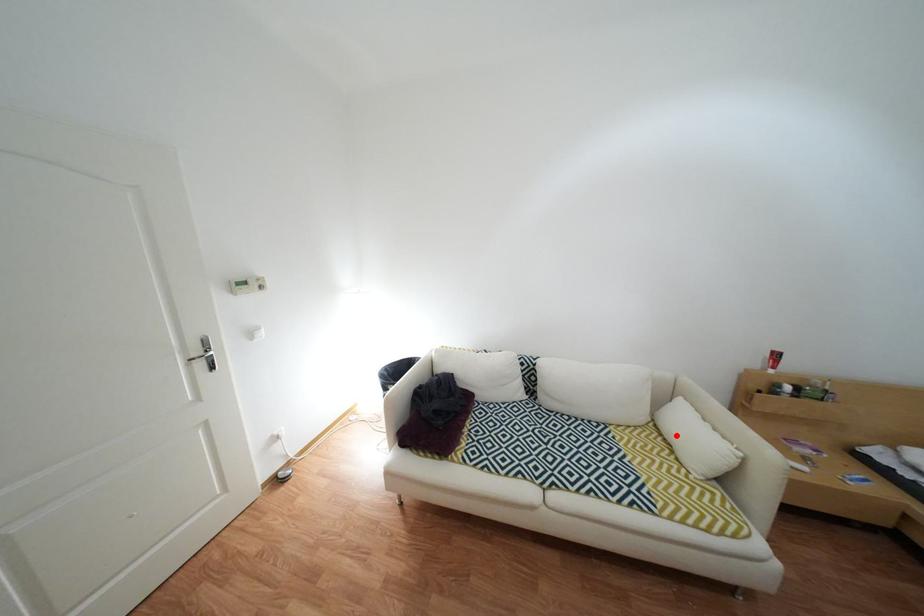
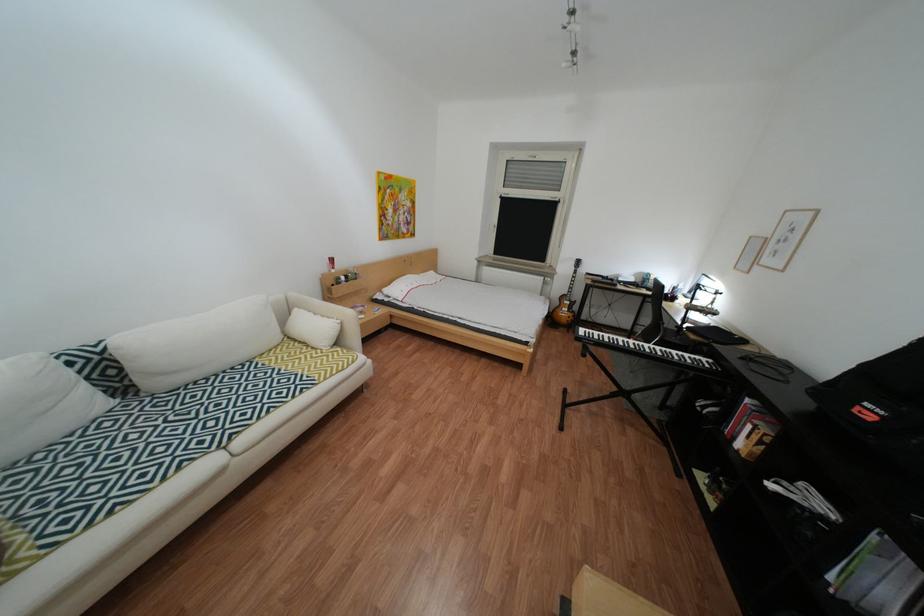
Where in the second image is the point corresponding to the highlighted location from the first image?

(311, 342)